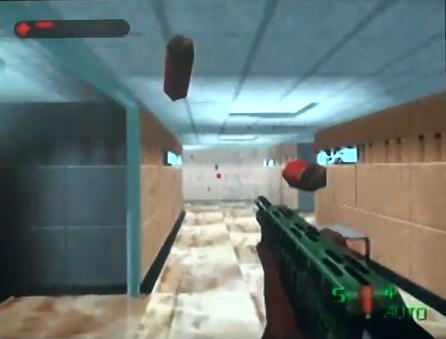
Where is `ceiling`? ceiling is located at coordinates (256, 65).